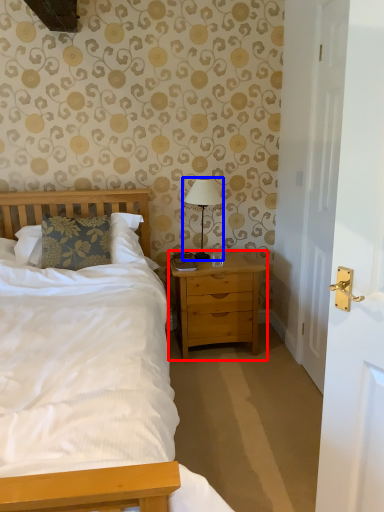
Question: Which point is further to the camera, nightstand (highlighted by a red box) or bedside lamp (highlighted by a blue box)?

Choices:
 (A) nightstand
 (B) bedside lamp

Answer: (B)